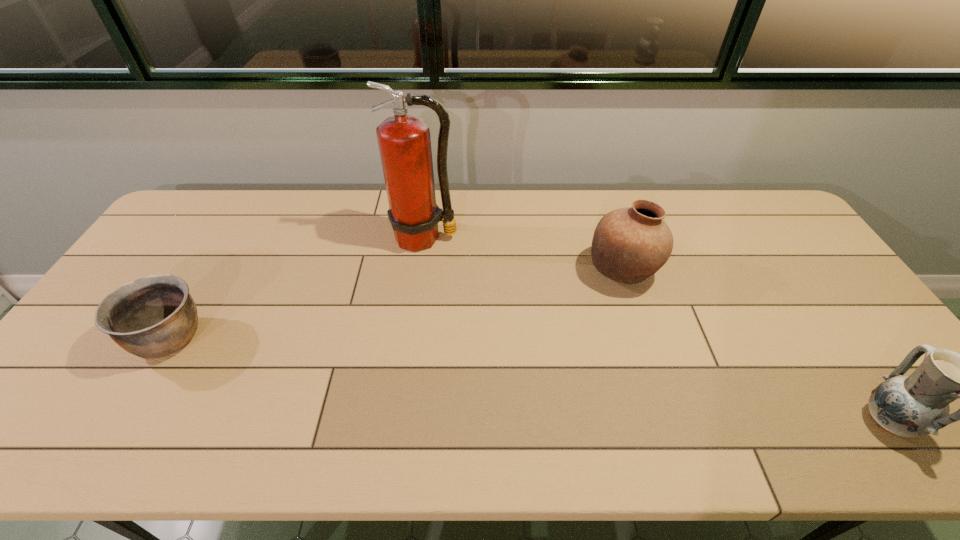
The image size is (960, 540). In order to click on vacant space located on either side of the nearest pottery in this screenshot , I will do `click(693, 420)`.

What are the coordinates of `vacant area situated 0.150m on either side of the nearest pottery` in the screenshot? It's located at (795, 420).

The height and width of the screenshot is (540, 960). I want to click on free point located 0.280m on either side of the nearest pottery, so click(737, 420).

The width and height of the screenshot is (960, 540). Identify the location of free region located 0.080m on the front of the shortest pottery. (134, 400).

The image size is (960, 540). I want to click on object that is positioned at the far edge, so click(x=404, y=141).

The height and width of the screenshot is (540, 960). Find the location of `object positioned at the near edge`. object positioned at the near edge is located at coordinates (917, 405).

The width and height of the screenshot is (960, 540). Identify the location of object that is at the left edge. (155, 316).

Identify the location of object that is at the right edge. The image size is (960, 540). (917, 405).

This screenshot has width=960, height=540. Identify the location of object that is at the near right corner. (917, 405).

Image resolution: width=960 pixels, height=540 pixels. In order to click on free space at the far edge of the desktop in this screenshot , I will do `click(496, 231)`.